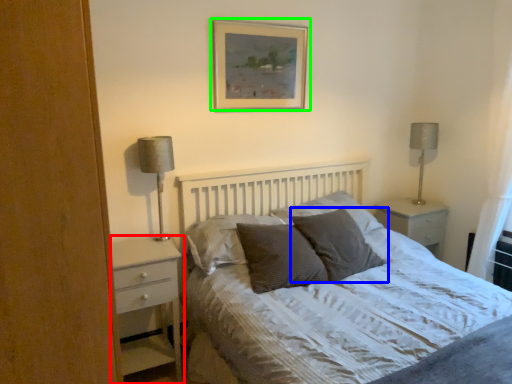
Question: Based on their relative distances, which object is farther from chest of drawers (highlighted by a red box)? Choose from pillow (highlighted by a blue box) and picture frame (highlighted by a green box).

Choices:
 (A) pillow
 (B) picture frame

Answer: (B)